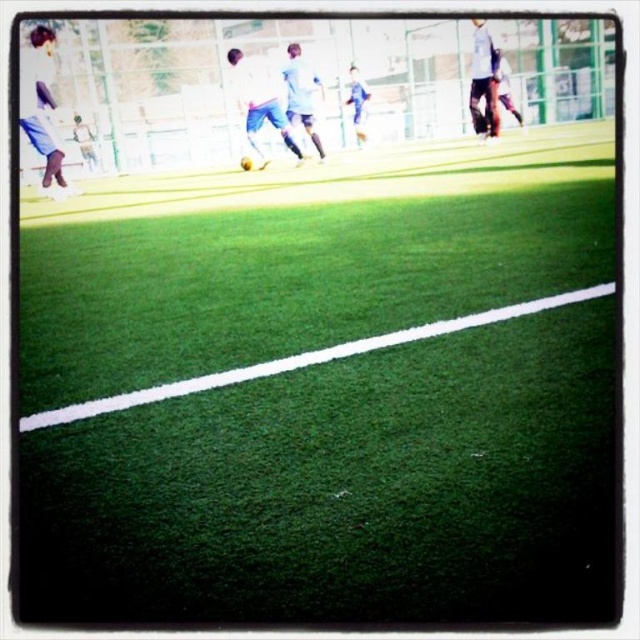
You are a photographer standing at the edge of the soccer field. You want to capture a photo of both the white matte shirt at upper right and the white matte soccer player at center in the same frame. Which object should you focus on first to ensure both are in focus?

The white matte shirt at upper right is larger in size compared to the white matte soccer player at center. To ensure both are in focus, you should focus on the larger object first, which is the white matte shirt at upper right.

You are a soccer referee observing the game. You notice two players, one wearing light blue fabric pants at left and another in blue jersey at center. Which player is closer to the ball?

The light blue fabric pants at left is in front of the blue jersey at center, so the player in light blue fabric pants at left is closer to the ball.

You are a soccer coach observing the field. You notice the light blue fabric pants at left and the blue jersey at center. Which object is positioned higher in the image?

The light blue fabric pants at left is taller than the blue jersey at center.